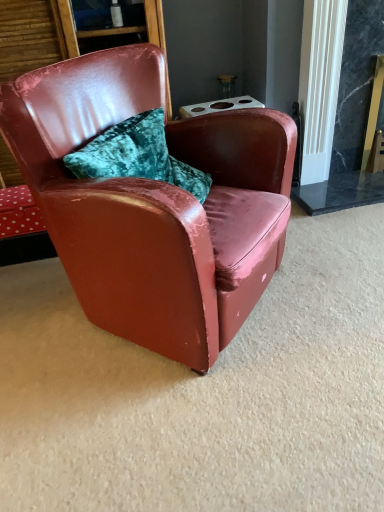
At what (x,y) coordinates should I click in order to perform the action: click on vacant area that is situated to the right of glossy leather chair at center. Please return your answer as a coordinate pair (x, y). This screenshot has height=512, width=384. Looking at the image, I should click on (331, 286).